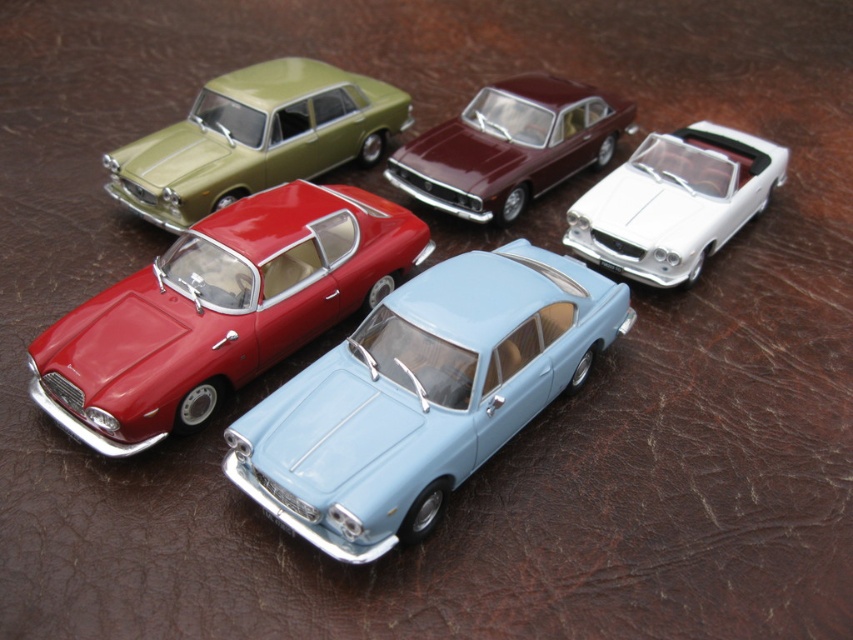
Question: Does light blue metallic car at center have a lesser width compared to white glossy convertible at upper right?

Choices:
 (A) no
 (B) yes

Answer: (A)

Question: Is light blue metallic car at center below glossy maroon car at upper center?

Choices:
 (A) yes
 (B) no

Answer: (A)

Question: Is light blue metallic car at center smaller than white glossy convertible at upper right?

Choices:
 (A) no
 (B) yes

Answer: (A)

Question: Which object appears farthest from the camera in this image?

Choices:
 (A) matte green car at upper left
 (B) glossy maroon car at upper center
 (C) white glossy convertible at upper right
 (D) light blue metallic car at center

Answer: (B)

Question: Which point is farther to the camera?

Choices:
 (A) (606, 301)
 (B) (424, 189)

Answer: (B)

Question: Which of the following is the closest to the observer?

Choices:
 (A) (305, 257)
 (B) (410, 429)

Answer: (B)